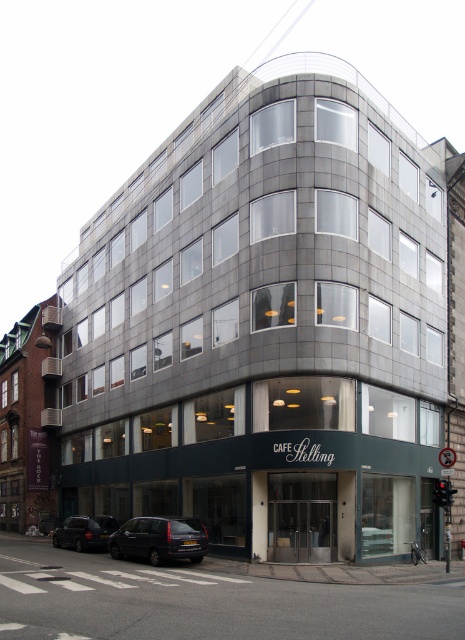
Consider the image. You are a delivery person trying to park your truck near the Cafe Stelling entrance. You see the dark gray metallic van at lower left and the dark gray metallic car at lower left. Which vehicle should you move to access the parking spot behind them?

You should move the dark gray metallic van at lower left because it is in front of the dark gray metallic car at lower left, so moving it would allow access to the parking spot behind.

You are standing in front of the modern corner building and want to reach the point marked as point (192, 545). If your walking speed is 1.2 meters per second, how many seconds will it take you to reach that point?

The point (192, 545) is 26.41 meters away from the viewer. At a speed of 1.2 meters per second, it would take approximately 22.01 seconds to reach the point.

You are standing on the sidewalk in front of the building and want to cross the street to reach the dark gray metallic van at lower left. The crosswalk is 100 feet away from you. Do you think you can reach the van before the crosswalk ends?

The dark gray metallic van at lower left is 84.26 feet away from you, so yes, you can reach the van before the crosswalk ends since it is closer than the crosswalk which is 100 feet away.